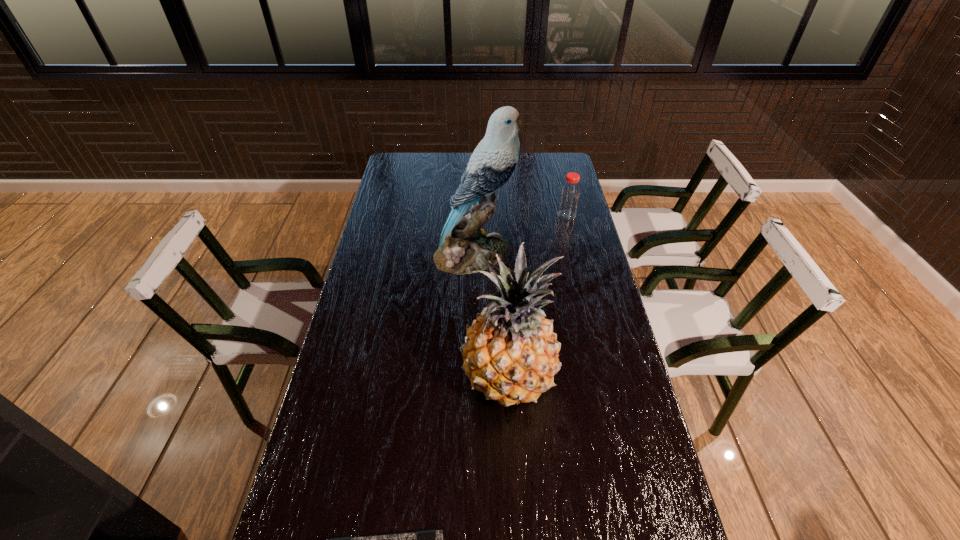
Where is `parakeet`? The height and width of the screenshot is (540, 960). parakeet is located at coordinates (464, 247).

Where is `the third nearest object`? the third nearest object is located at coordinates (464, 247).

Find the location of a particular element. Image resolution: width=960 pixels, height=540 pixels. the second nearest object is located at coordinates (510, 353).

This screenshot has height=540, width=960. I want to click on pineapple, so click(510, 353).

This screenshot has height=540, width=960. I want to click on bottle, so click(569, 198).

Locate an element on the screen. This screenshot has width=960, height=540. the farthest object is located at coordinates (569, 198).

Where is `vacant space located 0.230m on the face of the third nearest object`? Image resolution: width=960 pixels, height=540 pixels. vacant space located 0.230m on the face of the third nearest object is located at coordinates (576, 253).

At what (x,y) coordinates should I click in order to perform the action: click on free space located on the left of the second nearest object. Please return your answer as a coordinate pair (x, y). The image size is (960, 540). Looking at the image, I should click on (401, 378).

Where is `free region located 0.380m on the back of the farthest object`? Image resolution: width=960 pixels, height=540 pixels. free region located 0.380m on the back of the farthest object is located at coordinates (554, 164).

Identify the location of object present at the right edge. (569, 198).